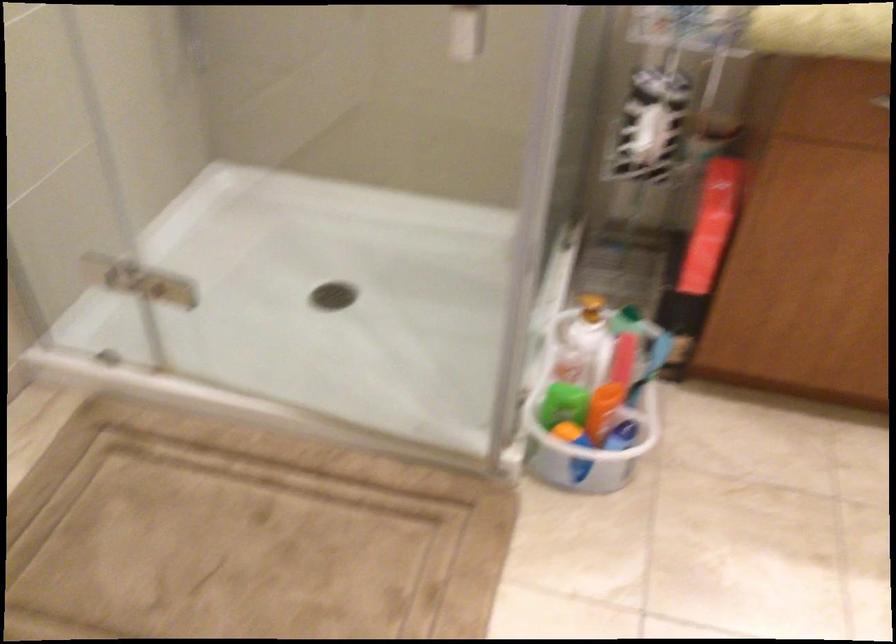
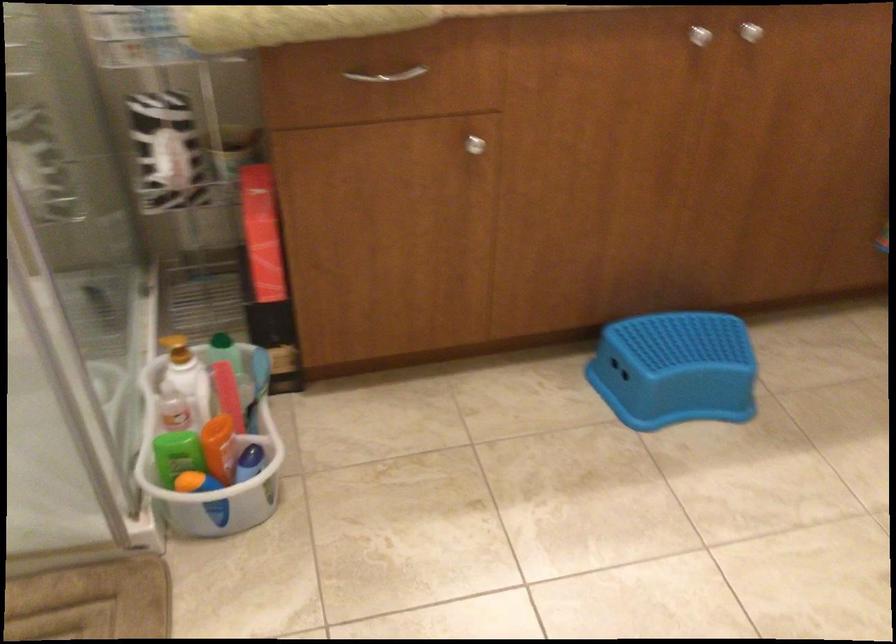
Where in the second image is the point corresponding to point (631, 422) from the first image?

(255, 451)